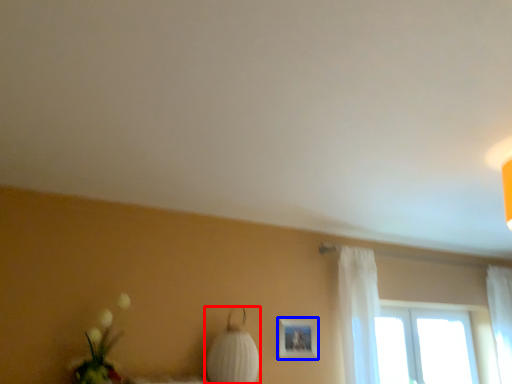
Question: Which point is closer to the camera, table lamp (highlighted by a red box) or picture frame (highlighted by a blue box)?

Choices:
 (A) table lamp
 (B) picture frame

Answer: (A)